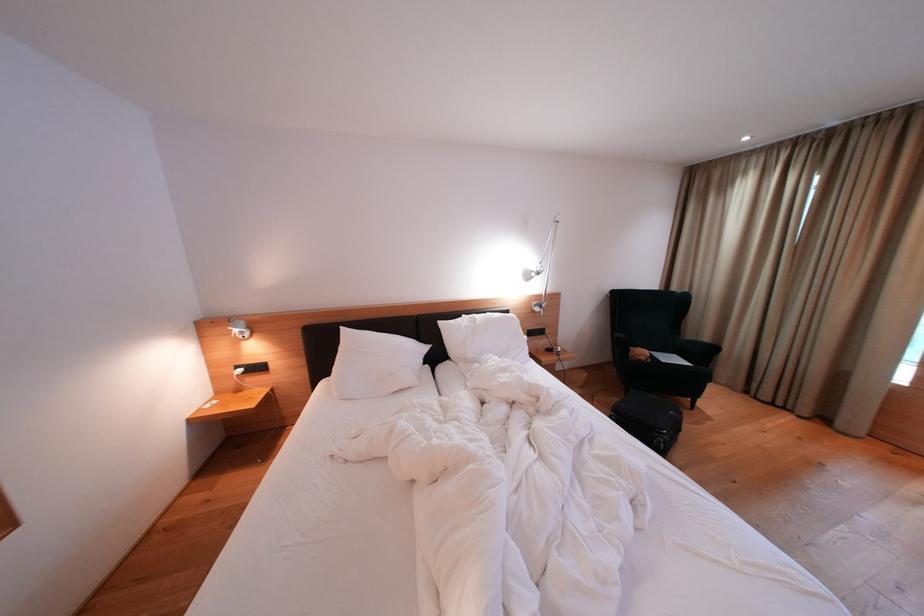
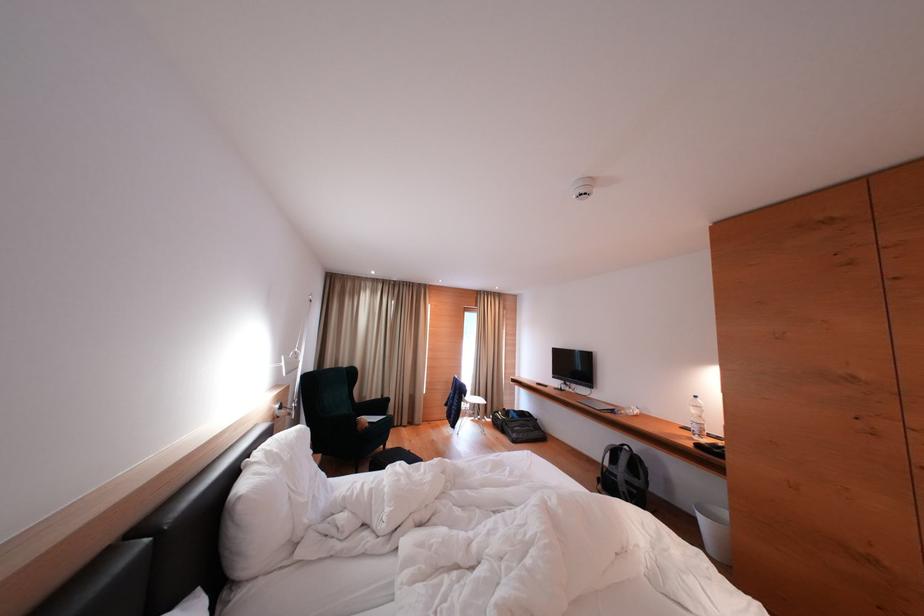
Find the pixel in the second image that matches the point at 636,355 in the first image.

(362, 428)